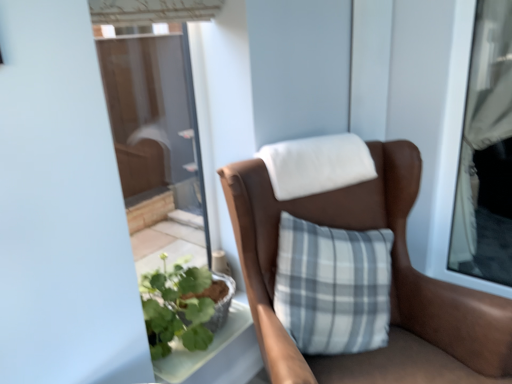
What is the approximate width of brown leather chair at center?

It is 36.61 inches.

What do you see at coordinates (391, 287) in the screenshot? I see `brown leather chair at center` at bounding box center [391, 287].

Locate an element on the screen. brown leather chair at center is located at coordinates (391, 287).

The height and width of the screenshot is (384, 512). What do you see at coordinates (486, 153) in the screenshot?
I see `matte white curtain at right` at bounding box center [486, 153].

You are a GUI agent. You are given a task and a screenshot of the screen. Output one action in this format:
    pyautogui.click(x=<x>, y=<y>)
    Task: Click on the matte white curtain at right
    The height and width of the screenshot is (384, 512).
    Given the screenshot: What is the action you would take?
    pyautogui.click(x=486, y=153)

Measure the distance between matte white curtain at right and camera.

They are 2.14 meters apart.

This screenshot has height=384, width=512. Identify the location of brown leather chair at center. (391, 287).

Which is more to the left, brown leather chair at center or matte white curtain at right?

Positioned to the left is brown leather chair at center.

Is brown leather chair at center further to camera compared to matte white curtain at right?

No, brown leather chair at center is closer to the viewer.

Considering the positions of point (395, 351) and point (505, 170), is point (395, 351) closer or farther from the camera than point (505, 170)?

Clearly, point (395, 351) is closer to the camera than point (505, 170).

From the image's perspective, is brown leather chair at center on matte white curtain at right?

No, from the image's perspective, brown leather chair at center is not above matte white curtain at right.

From a real-world perspective, is brown leather chair at center positioned under matte white curtain at right based on gravity?

Yes, from a real-world perspective, brown leather chair at center is below matte white curtain at right.

Can you confirm if brown leather chair at center is thinner than matte white curtain at right?

Incorrect, the width of brown leather chair at center is not less than that of matte white curtain at right.

Considering the sizes of brown leather chair at center and matte white curtain at right in the image, is brown leather chair at center taller or shorter than matte white curtain at right?

Considering their sizes, brown leather chair at center has less height than matte white curtain at right.

Does brown leather chair at center have a larger size compared to matte white curtain at right?

Correct, brown leather chair at center is larger in size than matte white curtain at right.

Choose the correct answer: Is brown leather chair at center inside matte white curtain at right or outside it?

brown leather chair at center cannot be found inside matte white curtain at right.

Are brown leather chair at center and matte white curtain at right far apart?

Yes, brown leather chair at center and matte white curtain at right are located far from each other.

Could you tell me if brown leather chair at center is turned towards matte white curtain at right?

No, brown leather chair at center is not facing towards matte white curtain at right.

Can you tell me how much brown leather chair at center and matte white curtain at right differ in facing direction?

brown leather chair at center and matte white curtain at right are facing 57.7 degrees away from each other.

The width and height of the screenshot is (512, 384). What are the coordinates of `window to the right of brown leather chair at center` in the screenshot? It's located at (486, 153).

Considering the positions of objects matte white curtain at right and brown leather chair at center in the image provided, who is more to the left, matte white curtain at right or brown leather chair at center?

brown leather chair at center.

Considering their positions, is matte white curtain at right located in front of or behind brown leather chair at center?

In the image, matte white curtain at right appears behind brown leather chair at center.

Is point (501, 210) farther from camera compared to point (263, 296)?

Yes, point (501, 210) is behind point (263, 296).

From the image's perspective, which is above, matte white curtain at right or brown leather chair at center?

matte white curtain at right, from the image's perspective.

From a real-world perspective, relative to brown leather chair at center, is matte white curtain at right vertically above or below?

matte white curtain at right is situated higher than brown leather chair at center in the real world.

Considering the relative sizes of matte white curtain at right and brown leather chair at center in the image provided, is matte white curtain at right thinner than brown leather chair at center?

Correct, the width of matte white curtain at right is less than that of brown leather chair at center.

Is matte white curtain at right taller or shorter than brown leather chair at center?

In the image, matte white curtain at right appears to be taller than brown leather chair at center.

Can you confirm if matte white curtain at right is bigger than brown leather chair at center?

Incorrect, matte white curtain at right is not larger than brown leather chair at center.

Choose the correct answer: Is matte white curtain at right inside brown leather chair at center or outside it?

matte white curtain at right is outside brown leather chair at center.

Would you consider matte white curtain at right to be distant from brown leather chair at center?

Yes, matte white curtain at right and brown leather chair at center are quite far apart.

Is matte white curtain at right facing towards brown leather chair at center?

Yes, matte white curtain at right is facing brown leather chair at center.

From the picture: How much distance is there between matte white curtain at right and brown leather chair at center?

matte white curtain at right is 3.91 feet away from brown leather chair at center.

Where is `chair below the matte white curtain at right (from the image's perspective)`? The height and width of the screenshot is (384, 512). chair below the matte white curtain at right (from the image's perspective) is located at coordinates (391, 287).

Locate an element on the screen. Image resolution: width=512 pixels, height=384 pixels. window that is behind the brown leather chair at center is located at coordinates (486, 153).

Locate an element on the screen. This screenshot has width=512, height=384. chair located in front of the matte white curtain at right is located at coordinates (391, 287).